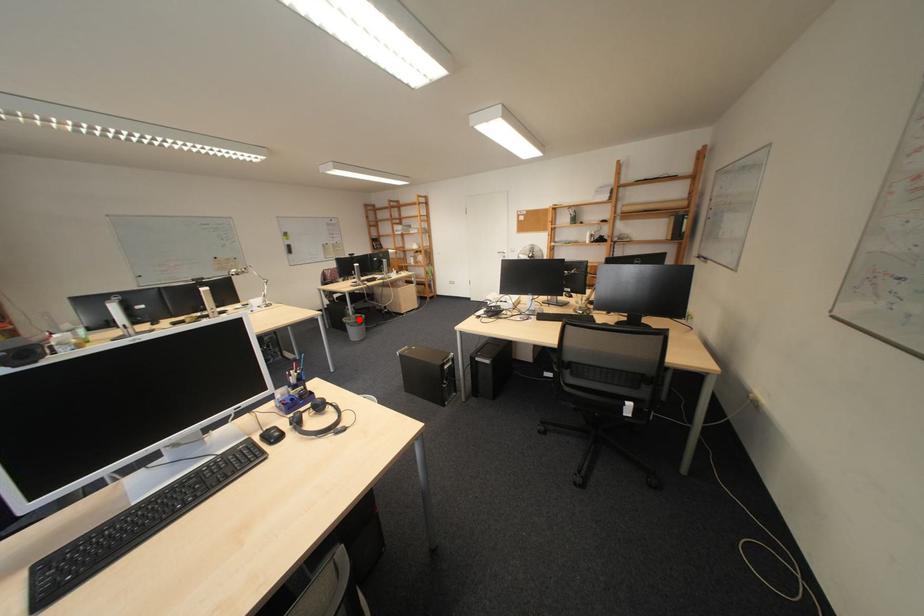
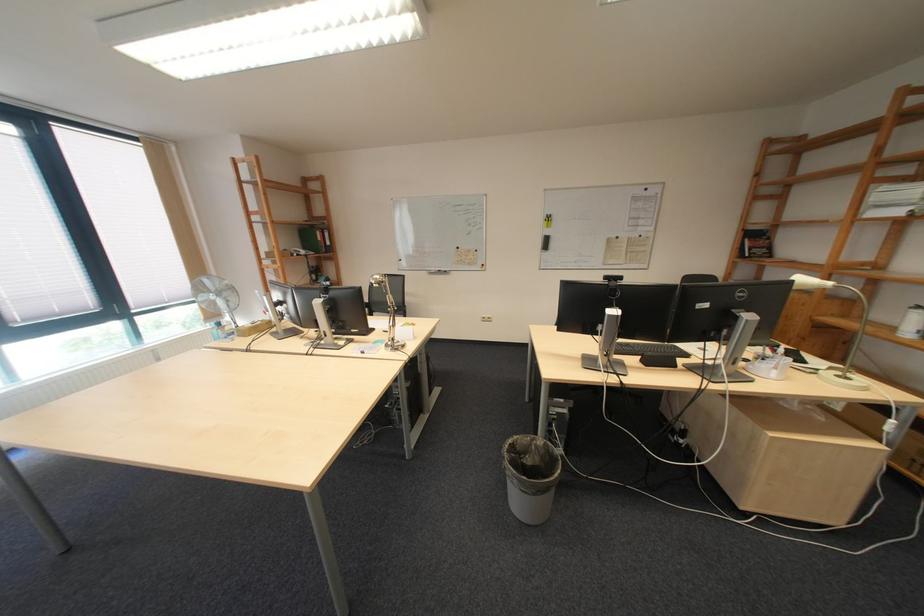
Question: A red point is marked in image1. In image2, is the corresponding 3D point closer to the camera or farther? Reply with the corresponding letter.

Choices:
 (A) The corresponding 3D point is closer.
 (B) The corresponding 3D point is farther.

Answer: (A)